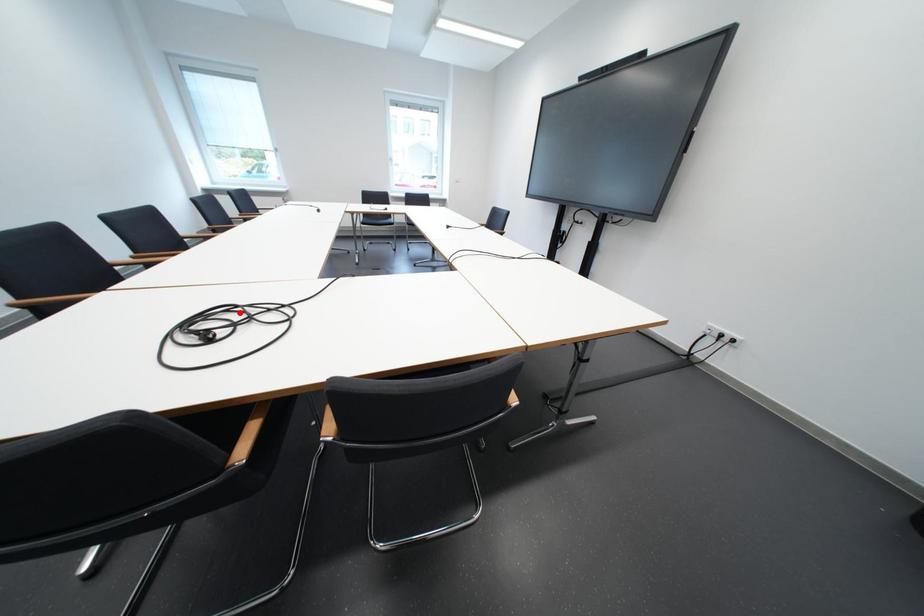
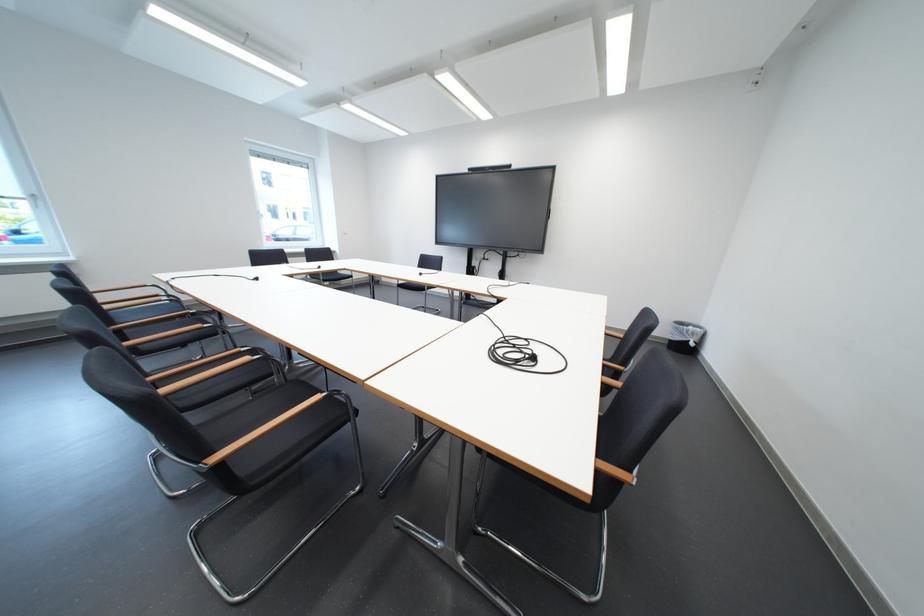
Find the pixel in the second image that matches the highlighted location in the first image.

(506, 351)